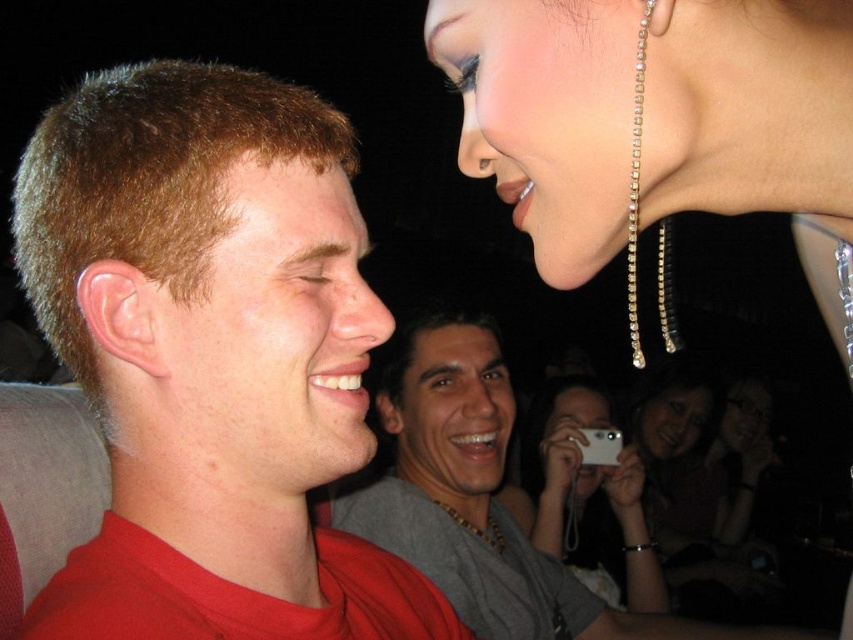
You are taking a photo at a social gathering and want to capture both the matte black camera at center and the white plastic phone at center in the frame. Which one is positioned to the right side of the other?

The matte black camera at center is positioned to the right of the white plastic phone at center.

You are a photographer at the event and want to capture a clear shot of both the gray necklace at center and the gold chain necklace at center. Since both are at the center, which one should you focus on to ensure it appears larger in the photo?

The gray necklace at center is taller than the gold chain necklace at center, so focusing on the gray necklace at center will make it appear larger in the photo.

You are at a party and want to locate the matte red shirt at left and the gold chain necklace at center. Which object is positioned more to the left side of the image?

The matte red shirt at left is positioned more to the left side of the image than the gold chain necklace at center.